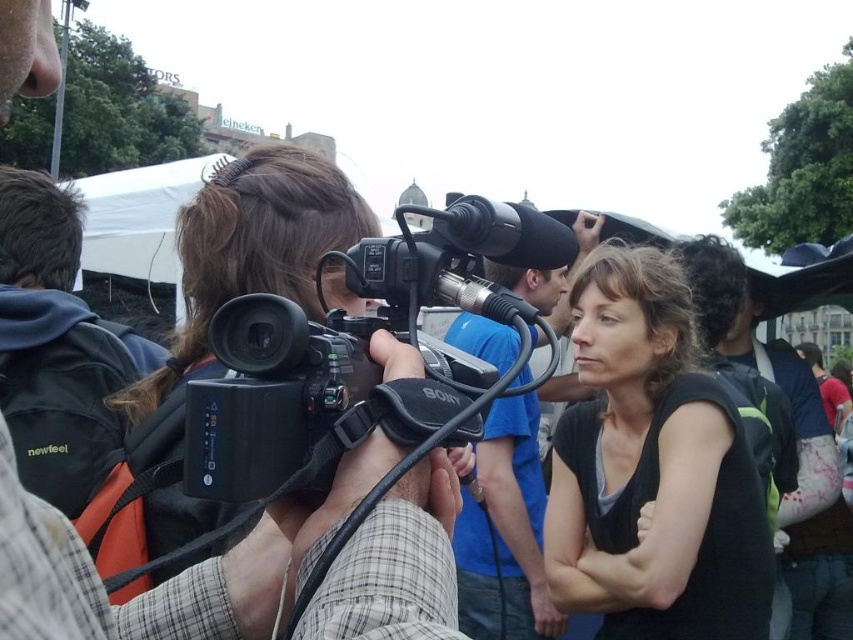
You are a photographer who needs to decide which equipment to carry. You have a black plastic camera at center and a black fabric backpack at left. Which one is easier to carry comfortably for a long time?

The black fabric backpack at left is easier to carry comfortably for a long time because it is larger and likely designed to distribute weight more evenly compared to the smaller black plastic camera at center.

You are a photographer trying to capture the interviewee in the scene. There is a black matte shirt at center located at point (653, 468). Can you focus your camera on the black matte shirt at center without moving the camera position?

The black matte shirt at center is located at point (653, 468), so yes, the camera can focus on it without moving since it is already centered at that coordinate.